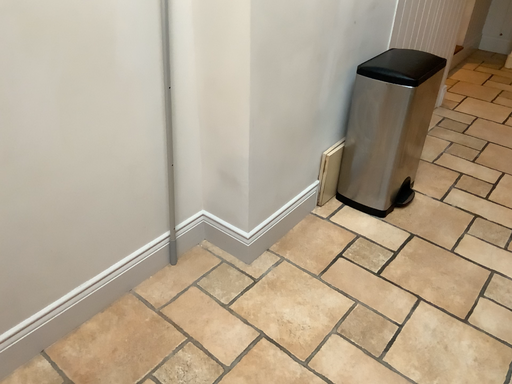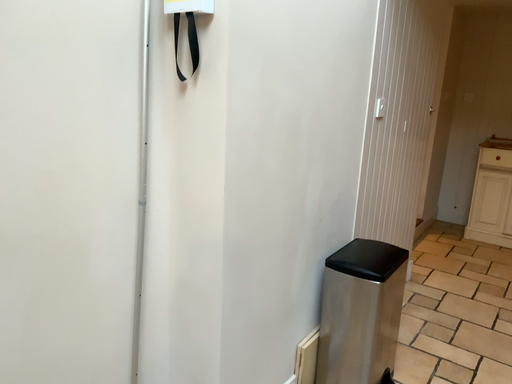
Question: How did the camera likely rotate when shooting the video?

Choices:
 (A) rotated downward
 (B) rotated upward

Answer: (B)